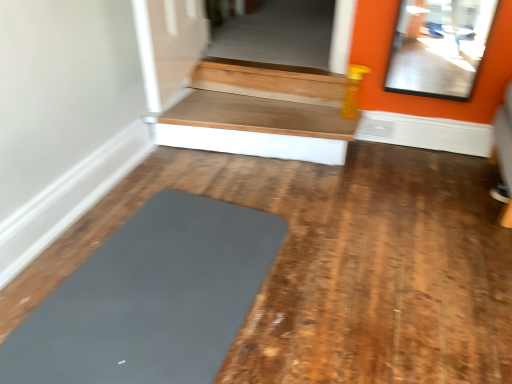
This screenshot has height=384, width=512. I want to click on vacant area that lies to the right of wooden at upper right, so (413, 178).